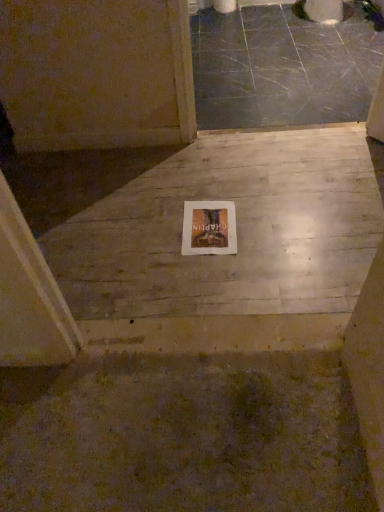
At what (x,y) coordinates should I click in order to perform the action: click on free space above white wood floor at center, the first concrete from the bottom (from a real-world perspective). Please return your answer as a coordinate pair (x, y). The image size is (384, 512). Looking at the image, I should click on (207, 225).